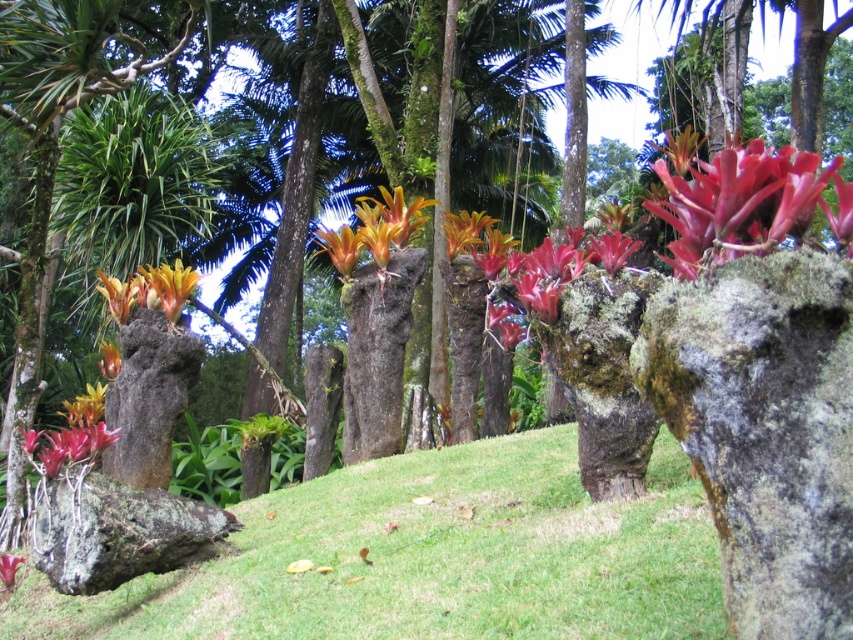
Question: Which object appears farthest from the camera in this image?

Choices:
 (A) vibrant orange bromeliad at lower left
 (B) vivid crimson bromeliad at upper right
 (C) mossy rock at center-right
 (D) orange matte flower at center

Answer: (D)

Question: Among these objects, which one is nearest to the camera?

Choices:
 (A) yellow-green glossy flower at lower left
 (B) vivid red flower at center

Answer: (B)

Question: Does yellow-green glossy flower at lower left have a greater width compared to orange matte flower at center?

Choices:
 (A) yes
 (B) no

Answer: (A)

Question: In this image, where is orange-yellow glossy flower at left located relative to vibrant orange and yellow flower at center?

Choices:
 (A) left
 (B) right

Answer: (A)

Question: Among these objects, which one is nearest to the camera?

Choices:
 (A) orange-yellow glossy flower at left
 (B) green grassy at lower center
 (C) yellow-orange glossy flower at left
 (D) vibrant orange bromeliad at lower left

Answer: (B)

Question: Does yellow-green glossy flower at lower left appear under vivid red flower at center?

Choices:
 (A) yes
 (B) no

Answer: (B)